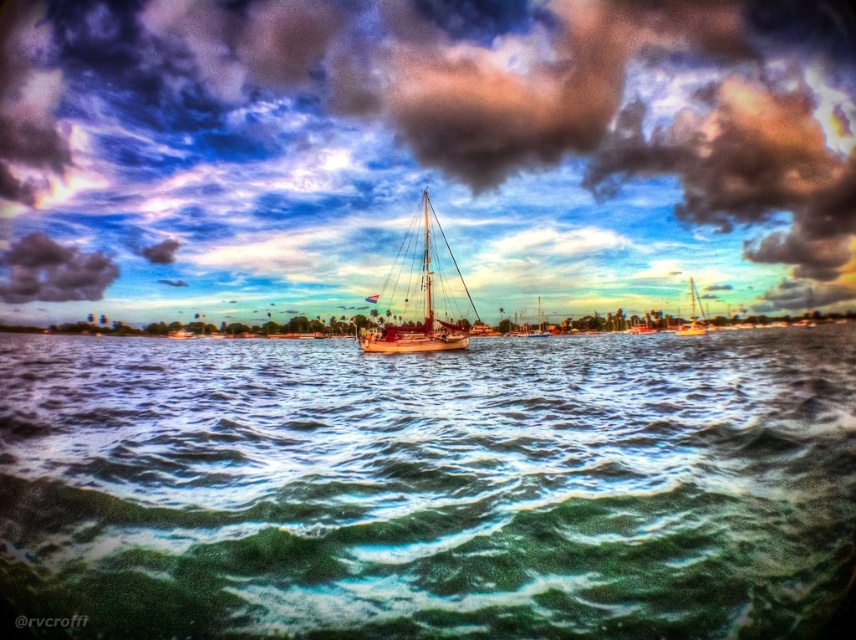
Question: Is dark gray cloud at upper left below wooden sailboat at center?

Choices:
 (A) no
 (B) yes

Answer: (A)

Question: Which of the following is the closest to the observer?

Choices:
 (A) (103, 572)
 (B) (700, 330)
 (C) (40, 237)

Answer: (A)

Question: Does dark gray cloud at upper center appear over dark gray cloud at upper left?

Choices:
 (A) no
 (B) yes

Answer: (B)

Question: Among these points, which one is nearest to the camera?

Choices:
 (A) (0, 296)
 (B) (771, 260)

Answer: (A)

Question: Can you confirm if wooden sailboat at center is bigger than shiny white sailboat at right?

Choices:
 (A) yes
 (B) no

Answer: (B)

Question: Which object is closer to the camera taking this photo?

Choices:
 (A) shiny white sailboat at right
 (B) wooden sailboat at center

Answer: (B)